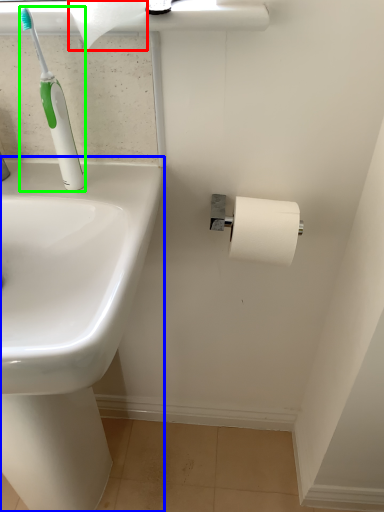
Question: Which is farther away from toilet paper (highlighted by a red box)? sink (highlighted by a blue box) or toilet brush (highlighted by a green box)?

Choices:
 (A) sink
 (B) toilet brush

Answer: (A)